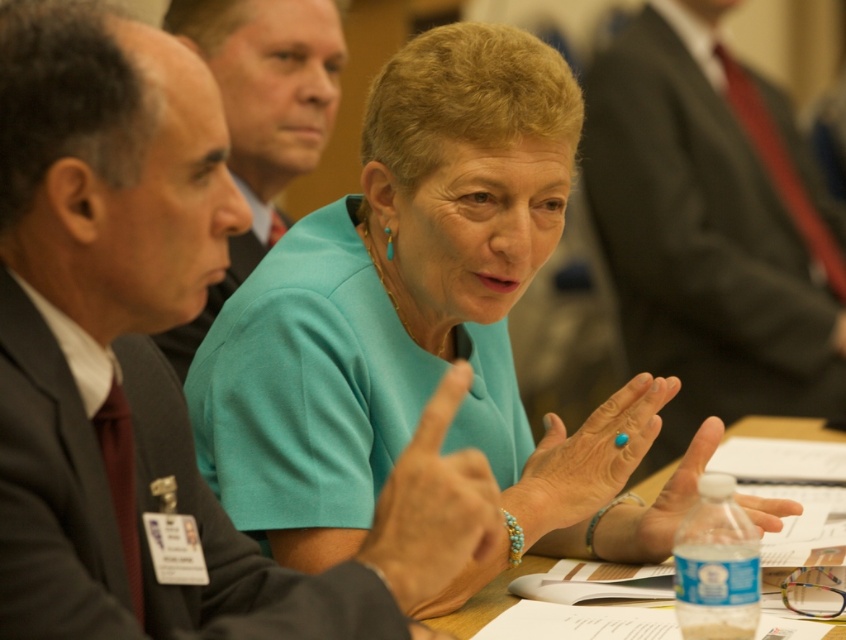
Question: Is the position of matte black suit at upper right less distant than that of wooden table at center?

Choices:
 (A) no
 (B) yes

Answer: (A)

Question: Can you confirm if teal fabric blouse at center is wider than wooden table at center?

Choices:
 (A) no
 (B) yes

Answer: (B)

Question: Which point is farther from the camera taking this photo?

Choices:
 (A) (232, 65)
 (B) (779, 428)
 (C) (171, 164)

Answer: (B)

Question: Which object appears closest to the camera in this image?

Choices:
 (A) matte black suit at upper right
 (B) matte black suit at left
 (C) matte black suit at center
 (D) wooden table at center

Answer: (C)

Question: Can you confirm if teal fabric blouse at center is positioned to the right of wooden table at center?

Choices:
 (A) no
 (B) yes

Answer: (A)

Question: Which point appears farthest from the camera in this image?

Choices:
 (A) (294, 92)
 (B) (501, 336)

Answer: (A)